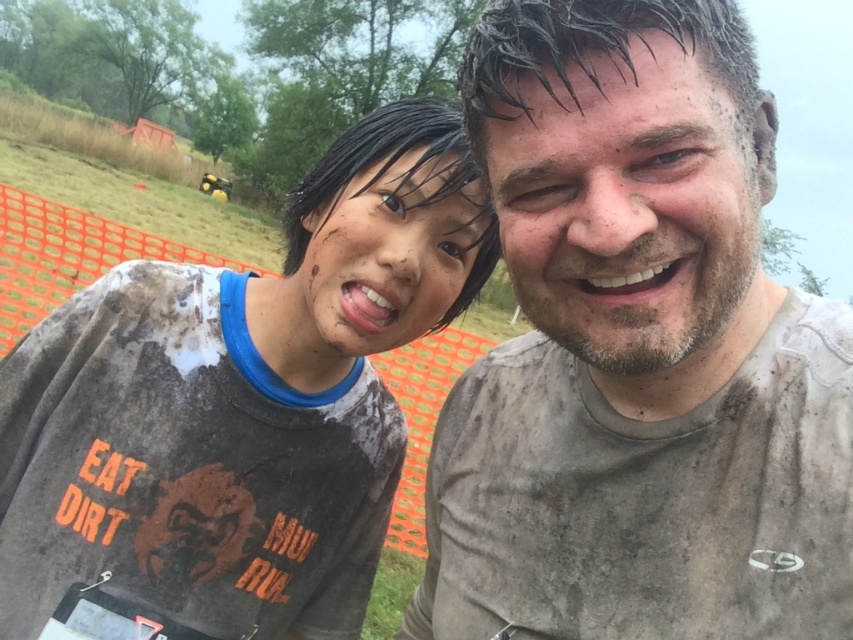
Can you confirm if muddy gray shirt at center is shorter than muddy t-shirt at left?

Correct, muddy gray shirt at center is not as tall as muddy t-shirt at left.

Is point (734, 13) positioned before point (405, 150)?

Yes, it is in front of point (405, 150).

Where is `muddy gray shirt at center`? The width and height of the screenshot is (853, 640). muddy gray shirt at center is located at coordinates (637, 352).